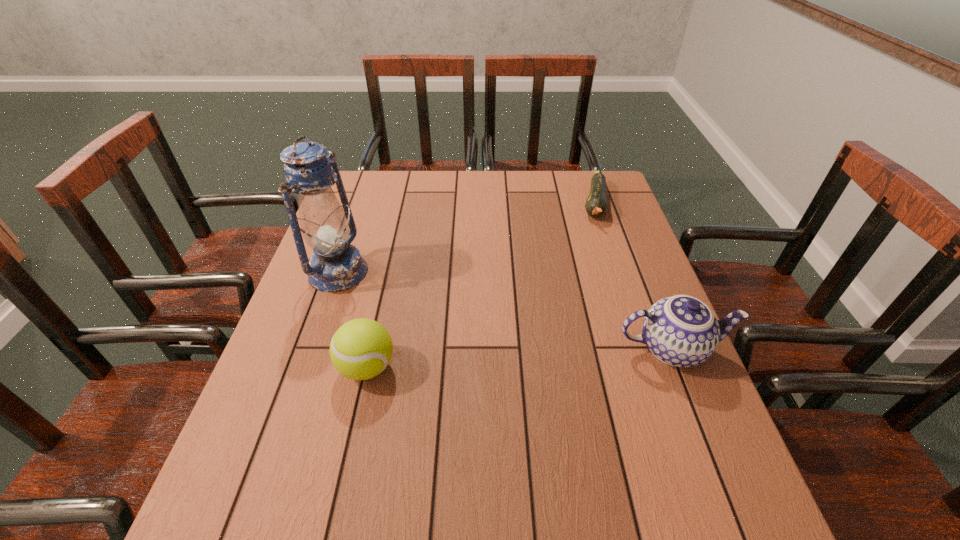
Find the location of a particular element. The image size is (960, 540). vacant area situated 0.080m on the front-facing side of the lantern is located at coordinates (387, 292).

The image size is (960, 540). I want to click on vacant space located 0.080m on the front-facing side of the lantern, so click(387, 292).

Where is `vacant space located on the front-facing side of the lantern`? vacant space located on the front-facing side of the lantern is located at coordinates (384, 291).

Locate an element on the screen. Image resolution: width=960 pixels, height=540 pixels. object present at the far edge is located at coordinates (596, 205).

Where is `tennis ball that is at the left edge`? tennis ball that is at the left edge is located at coordinates (361, 349).

Locate an element on the screen. The image size is (960, 540). lantern situated at the left edge is located at coordinates (335, 265).

Where is `chinaware present at the right edge`? The height and width of the screenshot is (540, 960). chinaware present at the right edge is located at coordinates (682, 331).

The width and height of the screenshot is (960, 540). What are the coordinates of `zucchini at the right edge` in the screenshot? It's located at (596, 205).

Image resolution: width=960 pixels, height=540 pixels. Find the location of `object located in the far right corner section of the desktop`. object located in the far right corner section of the desktop is located at coordinates (596, 205).

Locate an element on the screen. free region at the far edge of the desktop is located at coordinates (398, 178).